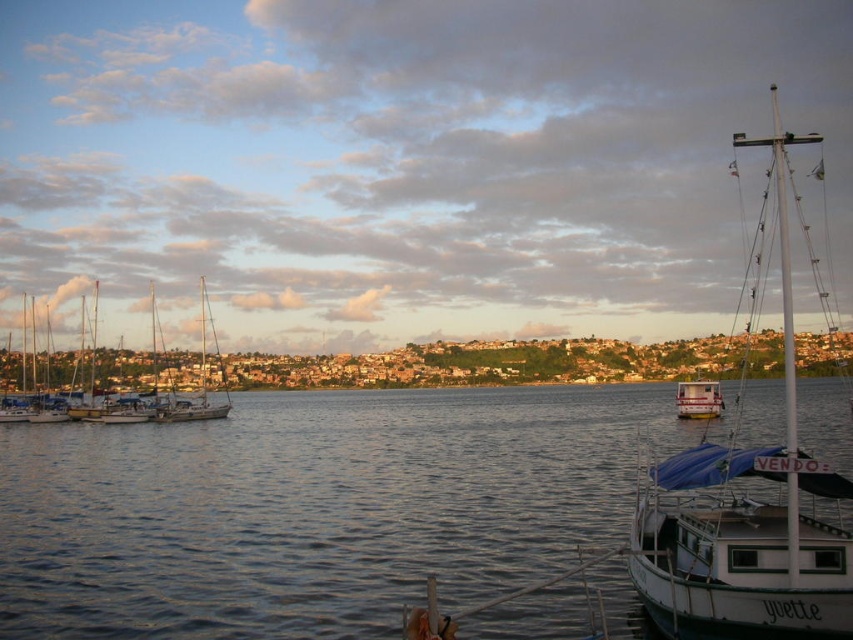
Question: Can you confirm if white matte sailboat at right is positioned below white matte boat at right?

Choices:
 (A) no
 (B) yes

Answer: (A)

Question: Which point is farther to the camera?

Choices:
 (A) white matte sailboat at right
 (B) white matte boat at right

Answer: (B)

Question: Can you confirm if clear water at center is positioned above white sailboat at left?

Choices:
 (A) no
 (B) yes

Answer: (A)

Question: Which point is farther to the camera?

Choices:
 (A) white sailboat at left
 (B) white matte sailboat at right
 (C) clear water at center
 (D) white matte boat at right

Answer: (A)

Question: Is white sailboat at left closer to camera compared to white matte boat at right?

Choices:
 (A) yes
 (B) no

Answer: (B)

Question: Which of the following is the farthest from the observer?

Choices:
 (A) clear water at center
 (B) white matte boat at right
 (C) white matte sailboat at right

Answer: (B)